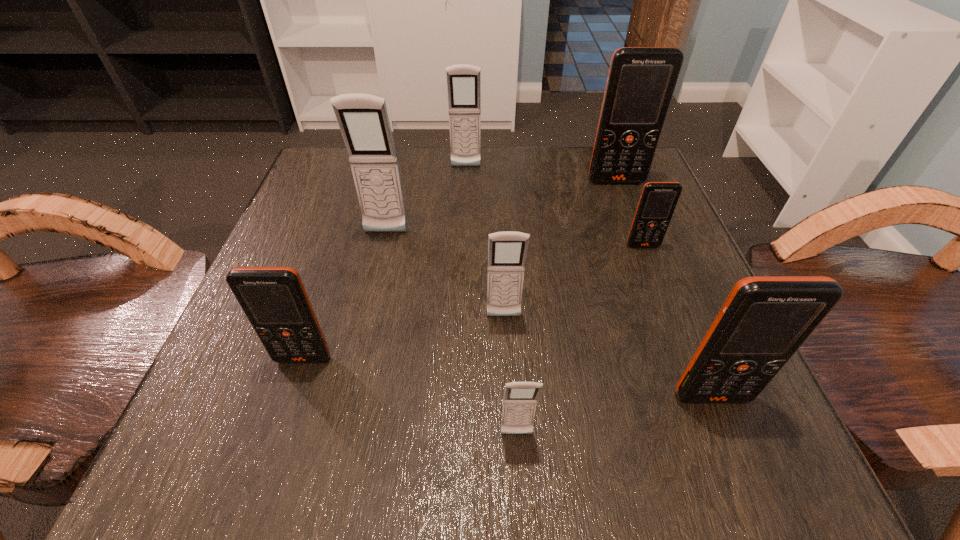
You are a GUI agent. You are given a task and a screenshot of the screen. Output one action in this format:
    pyautogui.click(x=<x>, y=<y>)
    Task: Click on the vacant space that is in between the second biggest gray cellular telephone and the third farthest cellular telephone
    The image size is (960, 540).
    Given the screenshot: What is the action you would take?
    pyautogui.click(x=426, y=200)

Find the location of a particular element. The height and width of the screenshot is (540, 960). object that can be found as the fifth closest to the nearest cellular telephone is located at coordinates (363, 119).

The width and height of the screenshot is (960, 540). I want to click on object that is the second closest to the second farthest cellular telephone, so click(x=463, y=81).

This screenshot has height=540, width=960. I want to click on cellular telephone that can be found as the fifth closest to the nearest gray cellular telephone, so click(x=363, y=119).

Identify which cellular telephone is the fourth closest to the smallest gray cellular telephone. Please provide its 2D coordinates. Your answer should be formatted as a tuple, i.e. [(x, y)], where the tuple contains the x and y coordinates of a point satisfying the conditions above.

[(658, 200)]

Where is `orange cellular telephone that is the nearest to the third smallest orange cellular telephone`? orange cellular telephone that is the nearest to the third smallest orange cellular telephone is located at coordinates tap(658, 200).

This screenshot has width=960, height=540. I want to click on orange cellular telephone that is the second closest one to the second farthest cellular telephone, so click(764, 320).

Choose which gray cellular telephone is the nearest neighbor to the fifth nearest cellular telephone. Please provide its 2D coordinates. Your answer should be formatted as a tuple, i.e. [(x, y)], where the tuple contains the x and y coordinates of a point satisfying the conditions above.

[(507, 251)]

Select which gray cellular telephone is the closest to the leftmost orange cellular telephone. Please provide its 2D coordinates. Your answer should be formatted as a tuple, i.e. [(x, y)], where the tuple contains the x and y coordinates of a point satisfying the conditions above.

[(507, 251)]